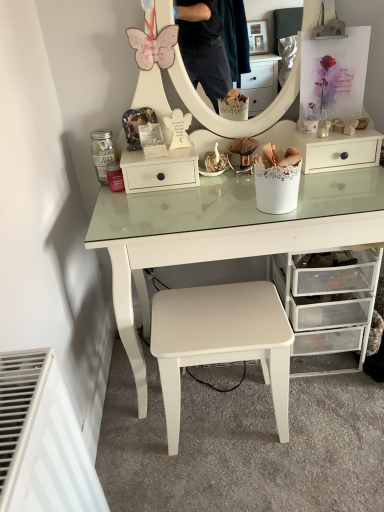
Question: Does white matte stool at center have a lesser width compared to white matte drawer at center?

Choices:
 (A) no
 (B) yes

Answer: (A)

Question: Considering the relative sizes of white matte stool at center and white matte drawer at center in the image provided, is white matte stool at center wider than white matte drawer at center?

Choices:
 (A) yes
 (B) no

Answer: (A)

Question: Can you confirm if white matte stool at center is positioned to the left of white matte drawer at center?

Choices:
 (A) no
 (B) yes

Answer: (A)

Question: Considering the relative sizes of white matte stool at center and white matte drawer at center in the image provided, is white matte stool at center smaller than white matte drawer at center?

Choices:
 (A) yes
 (B) no

Answer: (B)

Question: Is white matte drawer at center at the back of white matte stool at center?

Choices:
 (A) no
 (B) yes

Answer: (A)

Question: In terms of height, does clear plastic drawers at lower right look taller or shorter compared to white matte drawer at center?

Choices:
 (A) tall
 (B) short

Answer: (A)

Question: Considering the relative positions of clear plastic drawers at lower right and white matte drawer at center in the image provided, is clear plastic drawers at lower right to the left or to the right of white matte drawer at center?

Choices:
 (A) left
 (B) right

Answer: (B)

Question: From a real-world perspective, is clear plastic drawers at lower right above or below white matte drawer at center?

Choices:
 (A) below
 (B) above

Answer: (A)

Question: Looking at their shapes, would you say clear plastic drawers at lower right is wider or thinner than white matte drawer at center?

Choices:
 (A) thin
 (B) wide

Answer: (B)

Question: From a real-world perspective, relative to white matte drawer at center, is white matte stool at center vertically above or below?

Choices:
 (A) above
 (B) below

Answer: (B)

Question: From the image's perspective, relative to white matte drawer at center, is white matte stool at center above or below?

Choices:
 (A) above
 (B) below

Answer: (B)

Question: Considering their positions, is white matte stool at center located in front of or behind white matte drawer at center?

Choices:
 (A) behind
 (B) front

Answer: (B)

Question: Is point (170, 417) positioned closer to the camera than point (147, 190)?

Choices:
 (A) farther
 (B) closer

Answer: (B)

Question: In terms of size, does white matte drawer at center appear bigger or smaller than clear plastic drawers at lower right?

Choices:
 (A) big
 (B) small

Answer: (B)

Question: Looking at their shapes, would you say white matte drawer at center is wider or thinner than clear plastic drawers at lower right?

Choices:
 (A) wide
 (B) thin

Answer: (B)